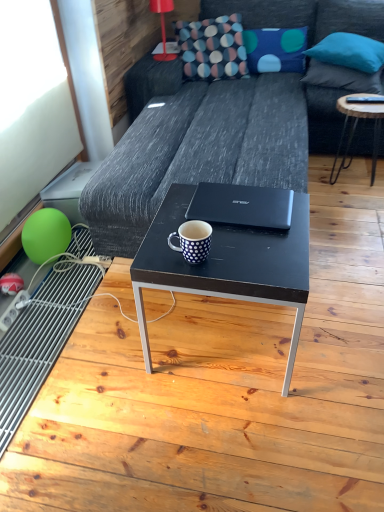
Identify the location of free space in front of black matte laptop at center. (251, 252).